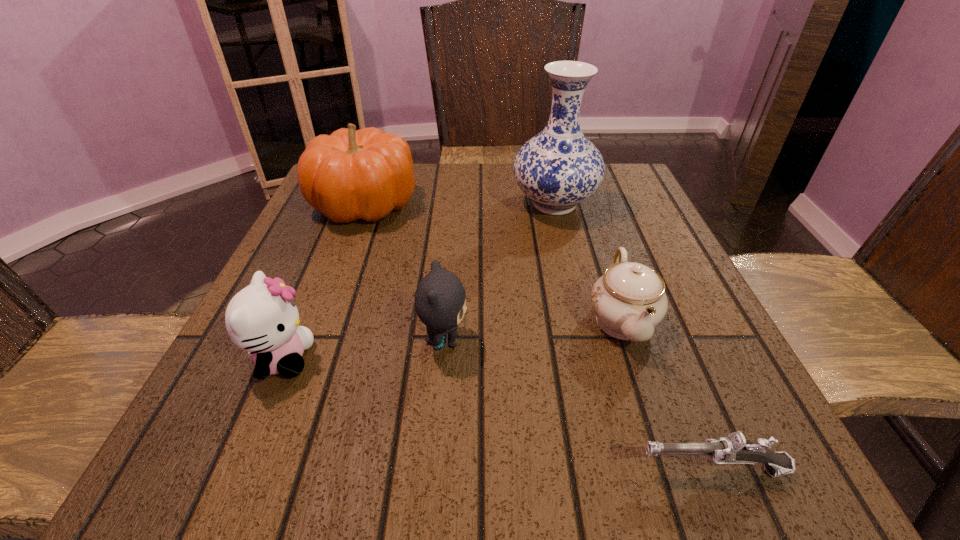
Image resolution: width=960 pixels, height=540 pixels. Find the location of `vase that is at the right edge`. vase that is at the right edge is located at coordinates (557, 169).

At what (x,y) coordinates should I click in order to perform the action: click on chinaware at the right edge. Please return your answer as a coordinate pair (x, y). Looking at the image, I should click on (629, 300).

Where is `gun situated at the right edge`? The image size is (960, 540). gun situated at the right edge is located at coordinates (734, 449).

Where is `object that is at the far left corner`? The image size is (960, 540). object that is at the far left corner is located at coordinates (351, 174).

Identify the location of object located at the far right corner. (557, 169).

The width and height of the screenshot is (960, 540). I want to click on object present at the near right corner, so click(x=734, y=449).

Where is `vacant point at the far edge`? The height and width of the screenshot is (540, 960). vacant point at the far edge is located at coordinates (450, 201).

Find the location of `free space at the near edge`. free space at the near edge is located at coordinates (412, 471).

Identify the location of vacant space at the left edge of the desktop. The image size is (960, 540). (320, 252).

In the image, there is a desktop. Where is `free space at the right edge`? free space at the right edge is located at coordinates (663, 253).